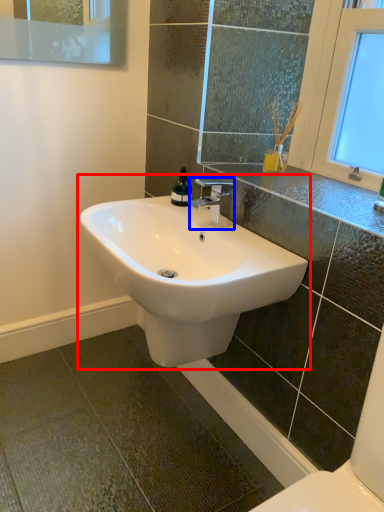
Question: Which of the following is the closest to the observer, sink (highlighted by a red box) or tap (highlighted by a blue box)?

Choices:
 (A) sink
 (B) tap

Answer: (A)